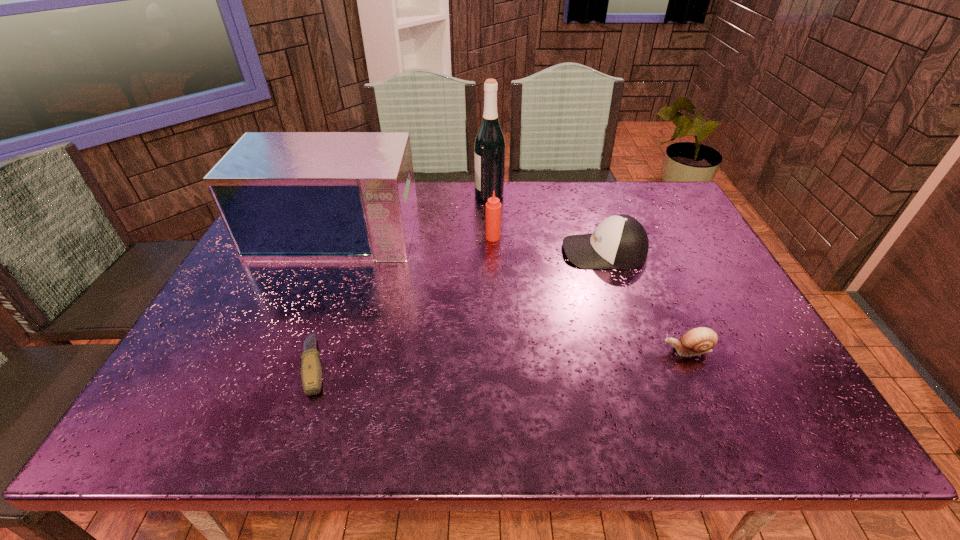
Identify the location of the tallest object. (489, 148).

What are the coordinates of `the fifth shortest object` in the screenshot? It's located at (282, 196).

Locate an element on the screen. The image size is (960, 540). Tabasco sauce is located at coordinates (493, 207).

I want to click on cap, so click(620, 241).

Identify the location of escargot. (697, 341).

Identify the location of the shortest object. This screenshot has height=540, width=960. (311, 372).

This screenshot has height=540, width=960. I want to click on vacant area located on the label of the wine bottle, so click(430, 195).

Image resolution: width=960 pixels, height=540 pixels. Find the location of `vacant space positioned on the label of the wine bottle`. vacant space positioned on the label of the wine bottle is located at coordinates (448, 195).

Identify the location of vacant position located 0.120m on the label of the wine bottle. The width and height of the screenshot is (960, 540). (439, 195).

Find the location of `blank area located 0.100m on the front-facing side of the microwave oven`. blank area located 0.100m on the front-facing side of the microwave oven is located at coordinates (314, 286).